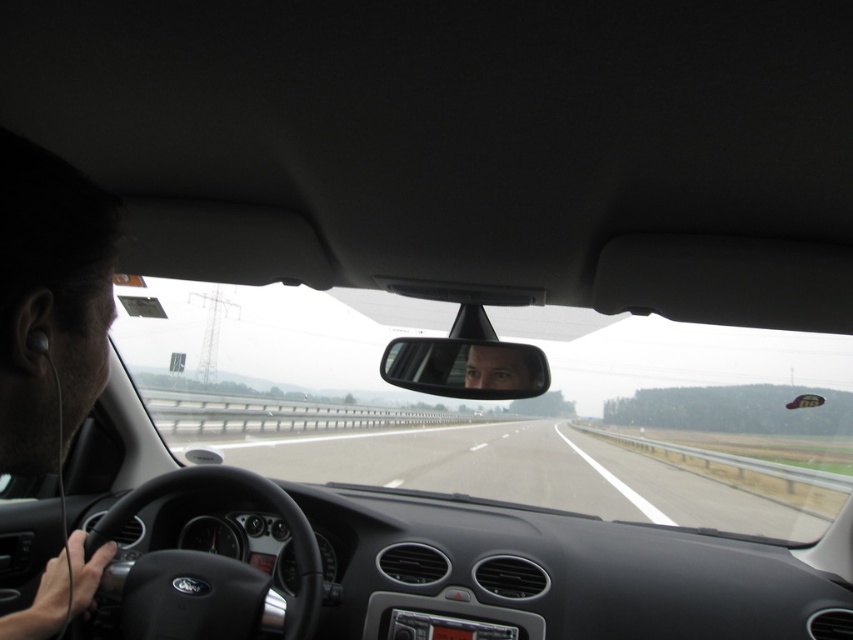
Question: Which object is closer to the camera taking this photo?

Choices:
 (A) clear plastic mirror at center
 (B) black matte earphones at left

Answer: (B)

Question: Which point is closer to the camera?

Choices:
 (A) transparent glass windshield at center
 (B) clear plastic mirror at center
 (C) black matte earphones at left

Answer: (C)

Question: Is transparent glass windshield at center below smooth skin face at center?

Choices:
 (A) yes
 (B) no

Answer: (A)

Question: Based on their relative distances, which object is farther from the clear plastic mirror at center?

Choices:
 (A) smooth skin face at center
 (B) transparent glass windshield at center
 (C) black matte earphones at left

Answer: (B)

Question: Can you confirm if clear plastic mirror at center is smaller than smooth skin face at center?

Choices:
 (A) yes
 (B) no

Answer: (B)

Question: Is black matte earphones at left positioned before clear plastic mirror at center?

Choices:
 (A) yes
 (B) no

Answer: (A)